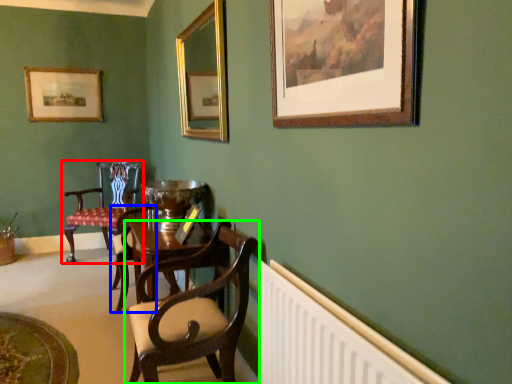
Question: Which object is the farthest from chair (highlighted by a red box)? Choose among these: armchair (highlighted by a blue box) or chair (highlighted by a green box).

Choices:
 (A) armchair
 (B) chair

Answer: (B)